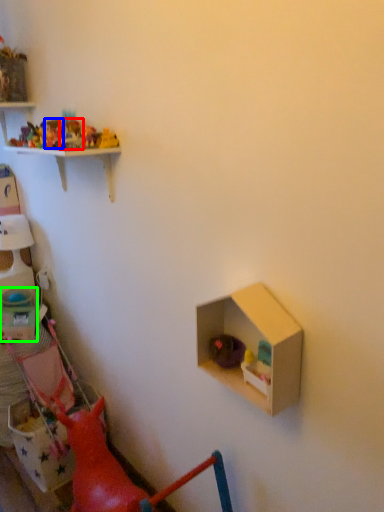
Question: Which is farther away from toy (highlighted by a red box)? toy (highlighted by a blue box) or box (highlighted by a green box)?

Choices:
 (A) toy
 (B) box

Answer: (B)